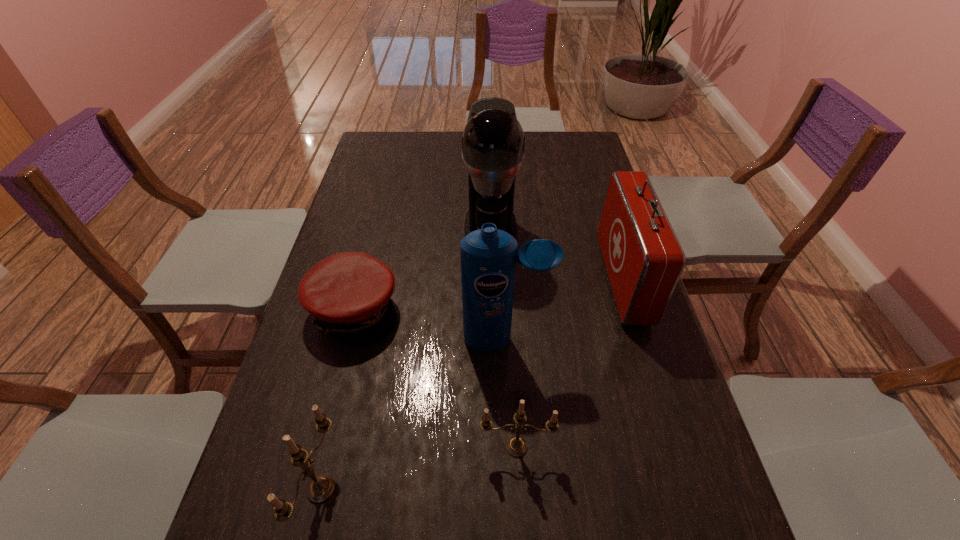
The image size is (960, 540). In order to click on vacant space positioned on the back of the second tallest object in this screenshot , I will do `click(500, 233)`.

The height and width of the screenshot is (540, 960). I want to click on vacant space situated 0.090m on the side of the rightmost object with the first aid cross symbol, so click(575, 280).

At what (x,y) coordinates should I click in order to perform the action: click on vacant point located 0.370m on the side of the rightmost object with the first aid cross symbol. Please return your answer as a coordinate pair (x, y). The width and height of the screenshot is (960, 540). Looking at the image, I should click on (475, 280).

Where is `free space located 0.160m on the side of the rightmost object with the first aid cross symbol`? This screenshot has height=540, width=960. free space located 0.160m on the side of the rightmost object with the first aid cross symbol is located at coordinates (550, 280).

The image size is (960, 540). Identify the location of object at the left edge. (348, 293).

Locate an element on the screen. object located in the right edge section of the desktop is located at coordinates (644, 260).

The image size is (960, 540). Identify the location of vacant space at the far edge of the desktop. (432, 149).

The image size is (960, 540). In the image, there is a desktop. What are the coordinates of `vacant space at the left edge` in the screenshot? It's located at (384, 225).

Locate an element on the screen. This screenshot has width=960, height=540. vacant space at the right edge of the desktop is located at coordinates (618, 379).

At what (x,y) coordinates should I click in order to perform the action: click on free spot at the far left corner of the desktop. Please return your answer as a coordinate pair (x, y). Image resolution: width=960 pixels, height=540 pixels. Looking at the image, I should click on (383, 145).